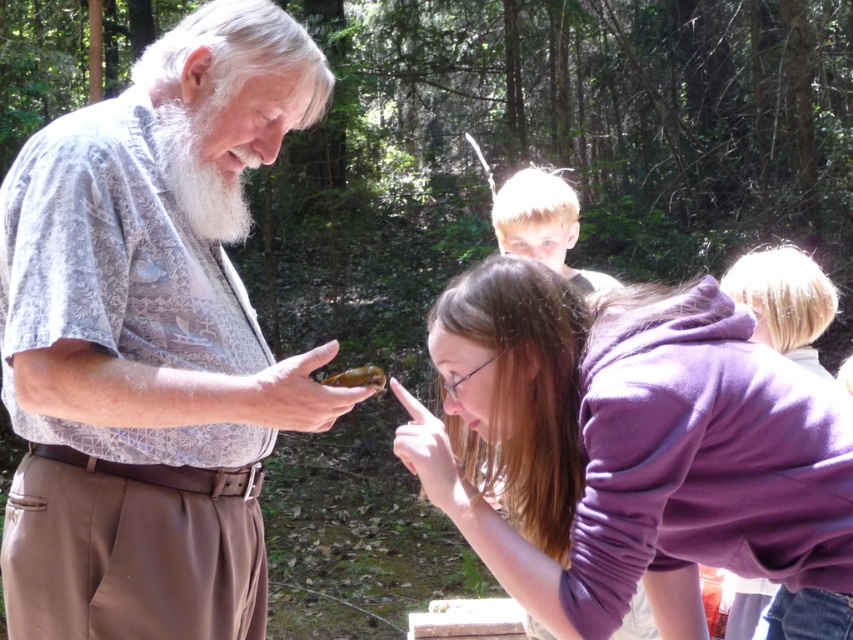
Question: Does purple fleece jacket at lower center have a smaller size compared to blonde hair at upper center?

Choices:
 (A) no
 (B) yes

Answer: (A)

Question: Does matte gray shirt at center appear over purple fleece jacket at lower center?

Choices:
 (A) no
 (B) yes

Answer: (B)

Question: Which point is farther to the camera?

Choices:
 (A) (225, 198)
 (B) (554, 189)
 (C) (628, 408)

Answer: (B)

Question: Is purple fleece jacket at lower center bigger than white fluffy beard at upper left?

Choices:
 (A) no
 (B) yes

Answer: (B)

Question: Among these objects, which one is farthest from the camera?

Choices:
 (A) blonde hair at upper center
 (B) white fluffy beard at upper left

Answer: (A)

Question: Among these objects, which one is farthest from the camera?

Choices:
 (A) purple fleece jacket at lower center
 (B) blonde hair at upper center
 (C) white fluffy beard at upper left
 (D) matte gray shirt at center

Answer: (B)